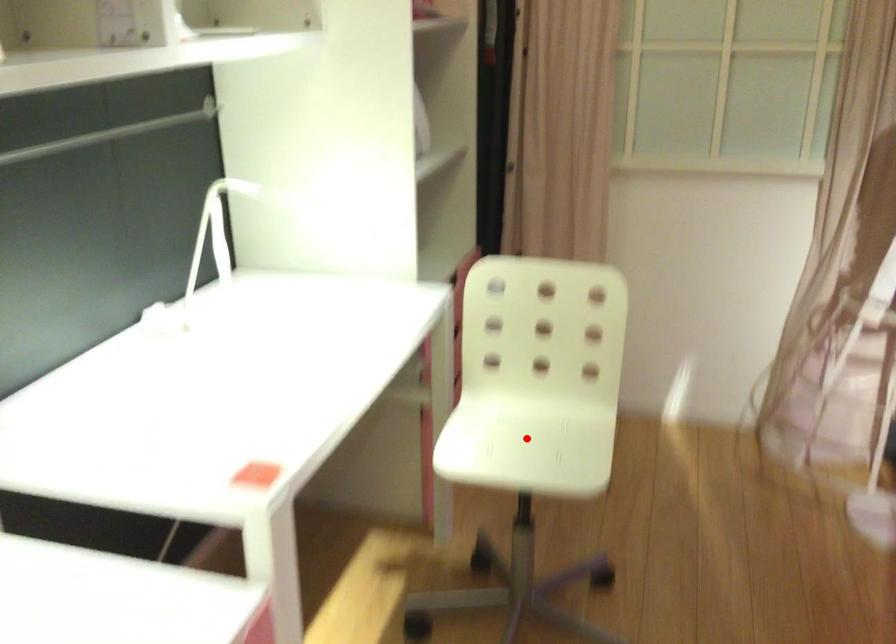
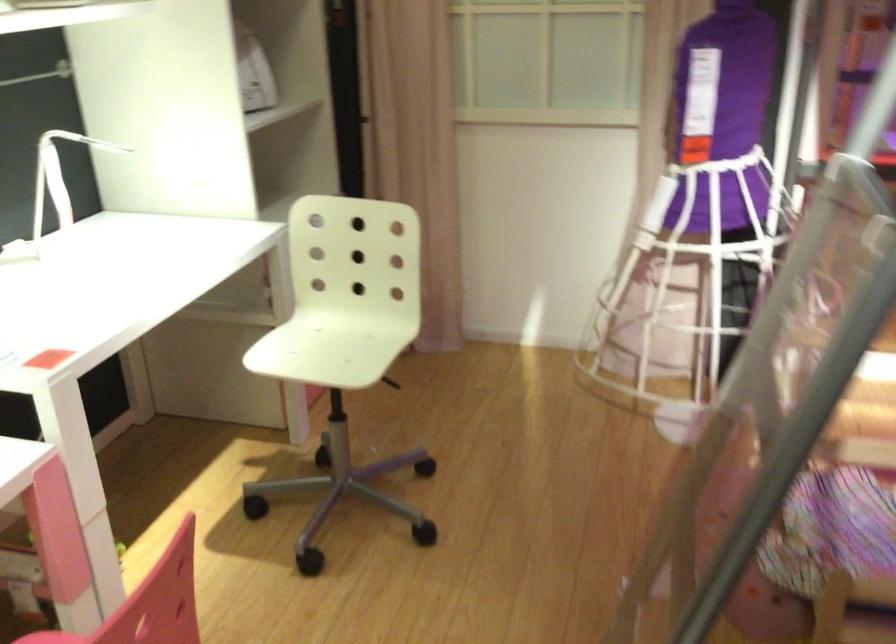
Find the pixel in the second image that matches the highlighted location in the first image.

(331, 345)